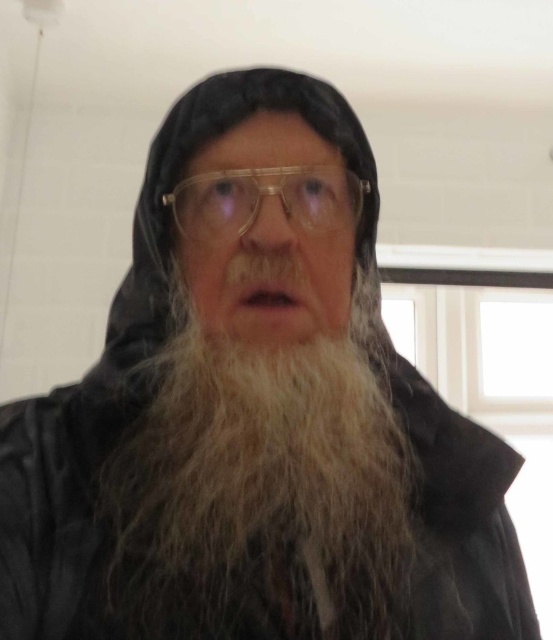
Looking at this image, you are an interior designer assessing the lighting in the room. You notice the white fuzzy beard at center and the transparent plastic glasses at center. Which object is wider when viewed from the front?

The white fuzzy beard at center is wider than the transparent plastic glasses at center.

You are a photographer setting up a portrait session. You need to ensure that the subject has enough space between their face and the wall behind them. Given the white fuzzy beard at center and the transparent plastic glasses at center, which object would require more space to avoid the wall obstructing it?

The white fuzzy beard at center is larger in size than the transparent plastic glasses at center, so it would require more space to avoid the wall obstructing it.

You are a photographer using a camera with a 12.5 inch focal length. You are currently positioned at the camera location and want to capture a closeup shot of the person in the scene. Is the distance between your camera and the point at coordinates point (131, 460) sufficient to achieve this closeup?

The distance between the camera and point (131, 460) is 20.82 inches. Since the camera has a 12.5 inch focal length, this distance is sufficient for a closeup shot as it exceeds the minimum required focal length.